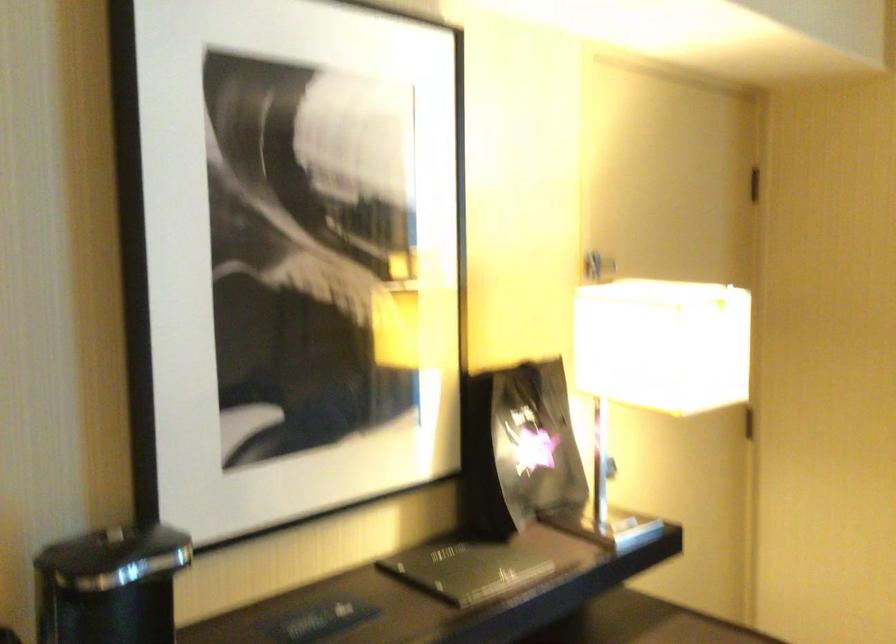
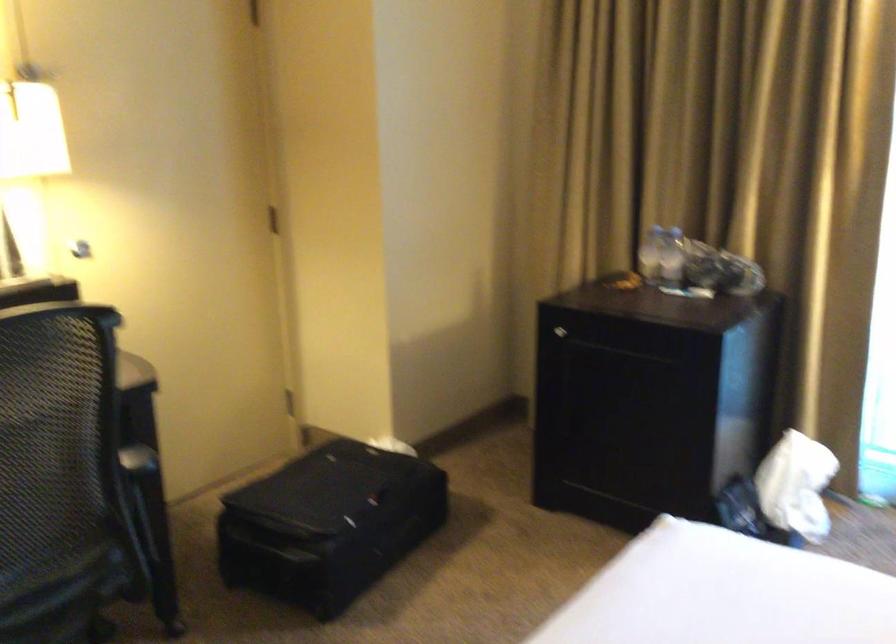
Which direction would the cameraman need to move to produce the second image?

The cameraman moved toward right, backward.